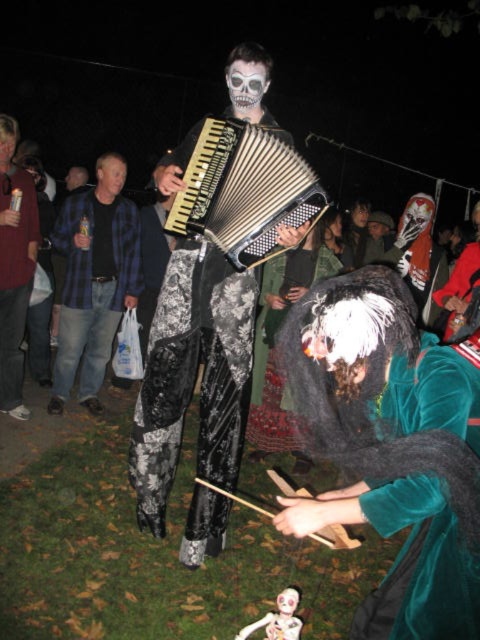
Is black textured accordion at center smaller than smooth skin face at upper left?

No, black textured accordion at center is not smaller than smooth skin face at upper left.

Does black textured accordion at center have a lesser height compared to smooth skin face at upper left?

In fact, black textured accordion at center may be taller than smooth skin face at upper left.

Who is more distant from viewer, (248,234) or (118,156)?

Positioned behind is point (118,156).

At what (x,y) coordinates should I click in order to perform the action: click on black textured accordion at center. Please return your answer as a coordinate pair (x, y). Looking at the image, I should click on tap(242, 189).

Is white painted skull at center to the left of smooth plastic cup at upper left from the viewer's perspective?

No, white painted skull at center is not to the left of smooth plastic cup at upper left.

Can you confirm if white painted skull at center is positioned to the right of smooth plastic cup at upper left?

Indeed, white painted skull at center is positioned on the right side of smooth plastic cup at upper left.

Is point (254, 67) positioned behind point (12, 132)?

No, it is in front of (12, 132).

Where is `white painted skull at center`? Image resolution: width=480 pixels, height=640 pixels. white painted skull at center is located at coordinates (245, 84).

Is black lace pants at center above smooth skin face at center?

No.

Is black lace pants at center to the left of smooth skin face at center from the viewer's perspective?

Yes, black lace pants at center is to the left of smooth skin face at center.

Is point (243, 301) farther from viewer compared to point (355, 216)?

That is False.

This screenshot has width=480, height=640. I want to click on black lace pants at center, so click(x=193, y=376).